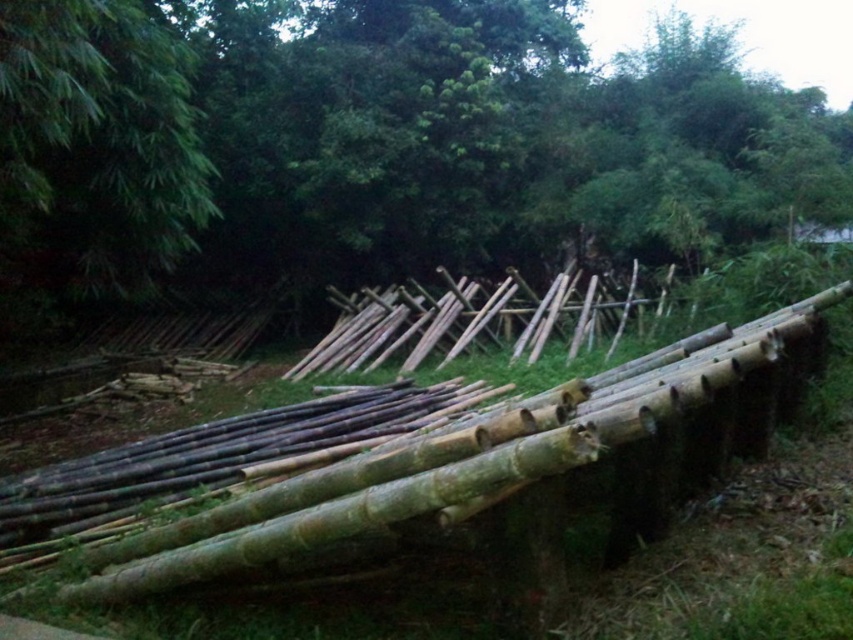
You are a hiker who wants to walk from the dense cluster of bamboo poles in the foreground to the forest in the background. Which bamboo pole should you step over first, the natural bamboo at center or the green bamboo at upper left?

You should step over the natural bamboo at center first because it is closer to you than the green bamboo at upper left, which is further away.

You are an environmental scientist assessing the bamboo growth in this area. You observe the natural bamboo at center and the green bamboo at upper left. Which one is more likely to be a mature bamboo based on their sizes?

The natural bamboo at center is more likely to be a mature bamboo because it has a larger size compared to the green bamboo at upper left.